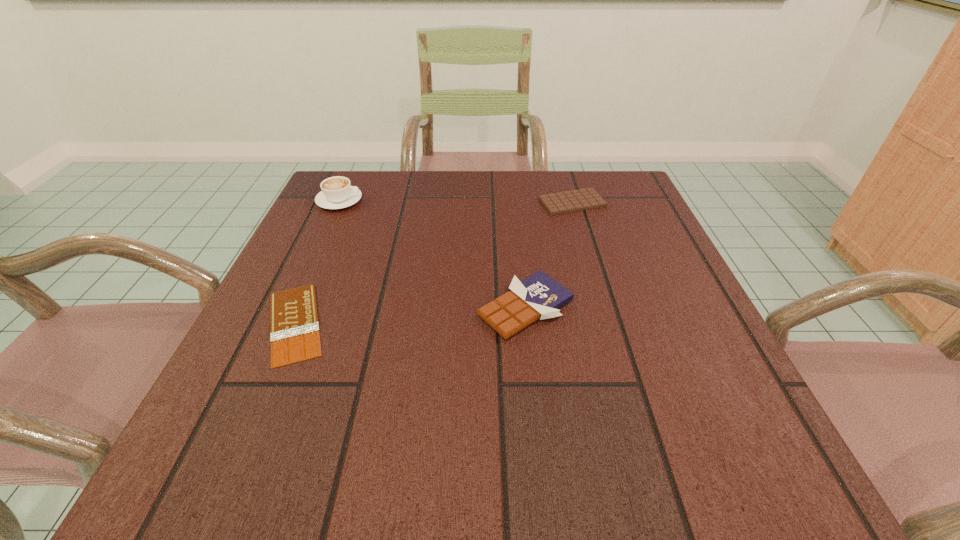
Image resolution: width=960 pixels, height=540 pixels. Identify the location of cappuccino. (337, 192).

I want to click on the tallest chocolate bar, so click(539, 296).

Where is `the farthest chocolate bar`? The width and height of the screenshot is (960, 540). the farthest chocolate bar is located at coordinates (582, 199).

This screenshot has width=960, height=540. What are the coordinates of `the second tallest chocolate bar` in the screenshot? It's located at (582, 199).

Where is `the shortest chocolate bar`? the shortest chocolate bar is located at coordinates (294, 327).

What are the coordinates of `the shortest object` in the screenshot? It's located at (294, 327).

Where is `free spot located 0.120m on the side of the tallest object with the handle`? free spot located 0.120m on the side of the tallest object with the handle is located at coordinates (412, 200).

This screenshot has height=540, width=960. I want to click on vacant space situated on the left of the third shortest object, so click(358, 308).

What are the coordinates of `vacant space located on the front of the third tallest object` in the screenshot? It's located at (607, 316).

Where is `free space located on the right of the shortest object`? The image size is (960, 540). free space located on the right of the shortest object is located at coordinates (566, 323).